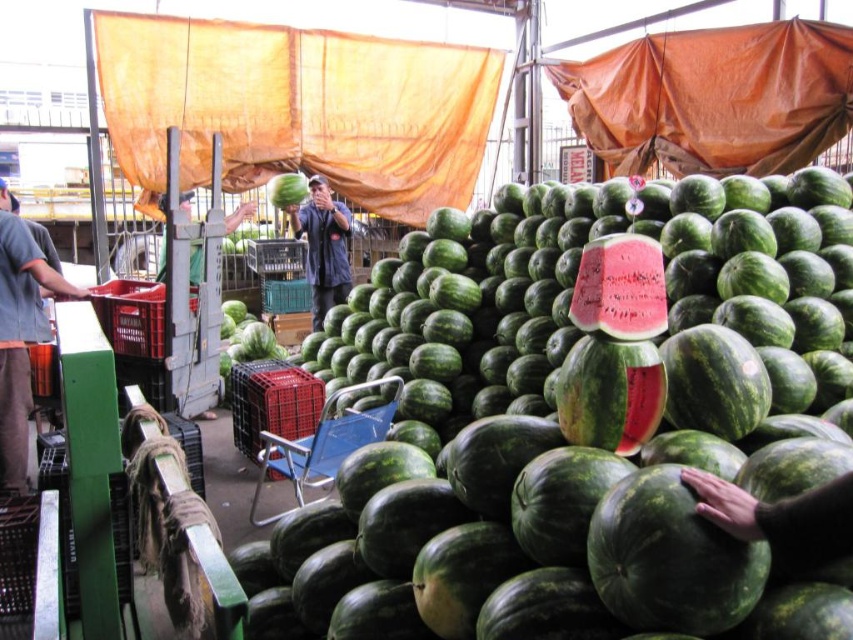
Is dark blue uniform at center positioned in front of green matte watermelon at center?

Yes, dark blue uniform at center is closer to the viewer.

How distant is dark blue uniform at center from green matte watermelon at center?

The distance of dark blue uniform at center from green matte watermelon at center is 17.58 inches.

Is point (312, 216) positioned before point (300, 176)?

Yes, point (312, 216) is closer to viewer.

You are a GUI agent. You are given a task and a screenshot of the screen. Output one action in this format:
    pyautogui.click(x=<x>, y=<y>)
    Task: Click on the dark blue uniform at center
    
    Given the screenshot: What is the action you would take?
    pyautogui.click(x=323, y=246)

Is point (296, 476) positioned in front of point (306, 189)?

Yes, point (296, 476) is in front of point (306, 189).

Find the location of a particular element. The height and width of the screenshot is (640, 853). metallic blue chair at center is located at coordinates (323, 444).

Can you confirm if metallic blue chair at center is shorter than dark blue uniform at center?

Yes, metallic blue chair at center is shorter than dark blue uniform at center.

Can you confirm if metallic blue chair at center is smaller than dark blue uniform at center?

No.

Is point (334, 458) positioned before point (311, 269)?

Yes, it is in front of point (311, 269).

In order to click on metallic blue chair at center in this screenshot , I will do `click(323, 444)`.